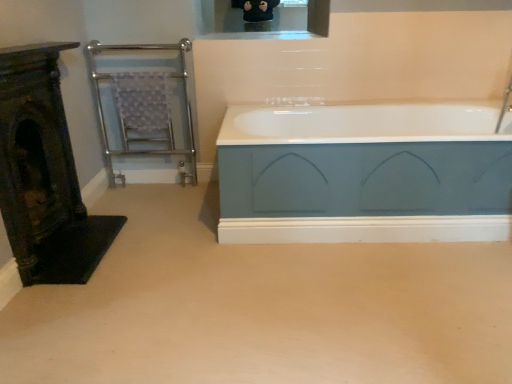
Locate an element on the screen. The height and width of the screenshot is (384, 512). free space to the left of teal matte bathtub at center is located at coordinates (159, 253).